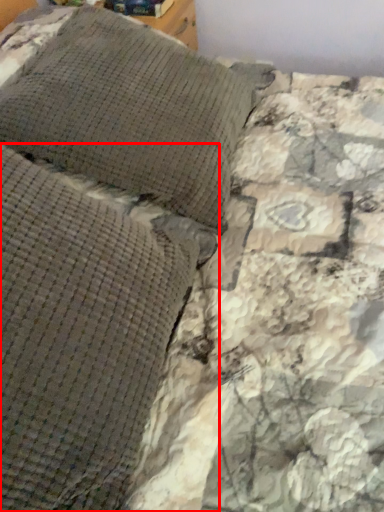
Question: From the image's perspective, considering the relative positions of pillow (annotated by the red box) and pillow in the image provided, where is pillow (annotated by the red box) located with respect to the staircase?

Choices:
 (A) below
 (B) above

Answer: (A)